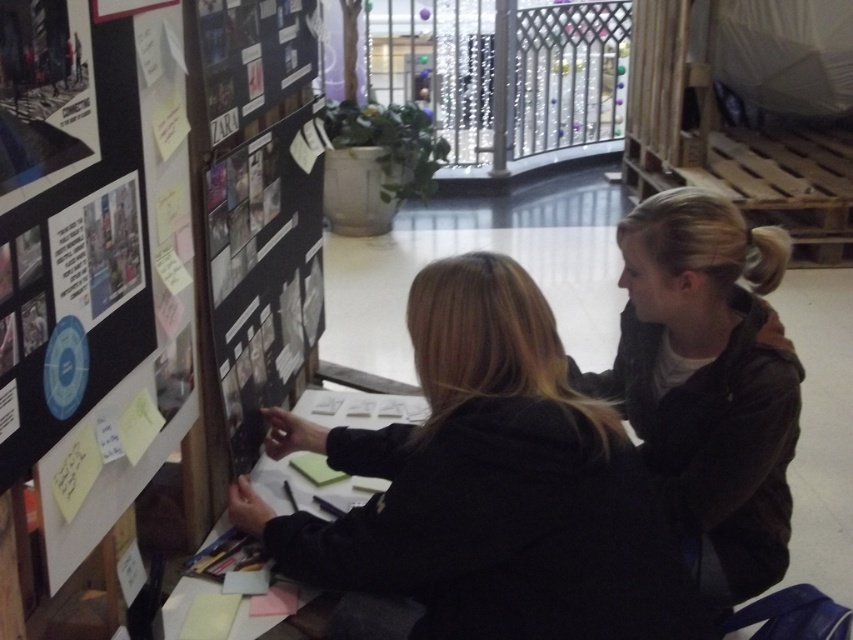
Based on the photo, you are standing in the room and want to see the matte black poster at upper left clearly. Is the dark brown jacket at upper right blocking your view of it?

The matte black poster at upper left is behind the dark brown jacket at upper right, so yes, the dark brown jacket at upper right is blocking your view of the matte black poster at upper left.

You are standing in front of the large display board and notice a point marked at coordinates (403, 492). If you want to touch this point with a 3.5 feet long stick, can you reach it?

The point at (403, 492) is 3.86 feet away from the camera. Since the stick is only 3.5 feet long, you cannot reach it with the stick.